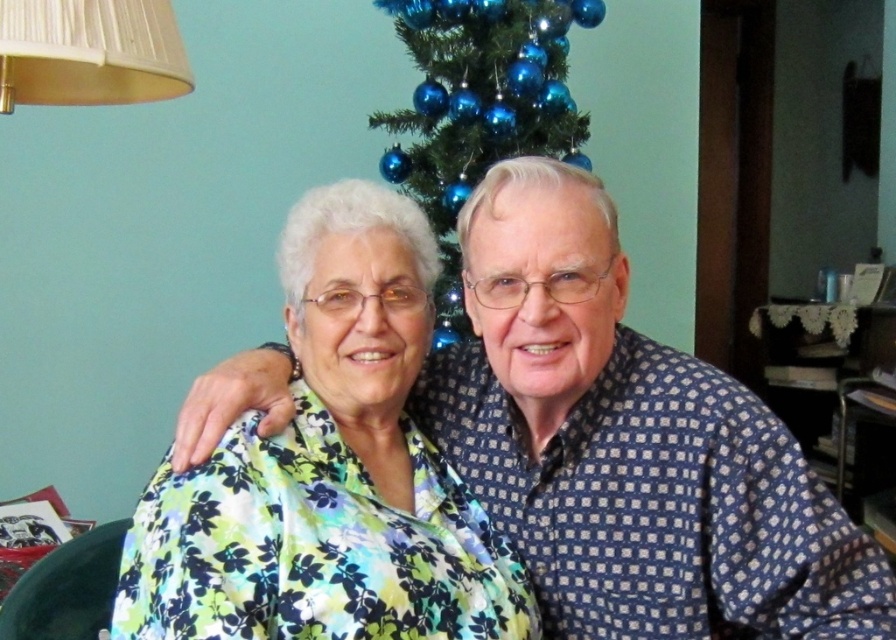
Question: Which is nearer to the floral fabric blouse at center?

Choices:
 (A) blue dotted shirt at center
 (B) blue glass ornaments at center

Answer: (A)

Question: In this image, where is blue dotted shirt at center located relative to blue glass ornaments at center?

Choices:
 (A) right
 (B) left

Answer: (A)

Question: Is floral fabric blouse at center below white pleated lampshade at upper left?

Choices:
 (A) no
 (B) yes

Answer: (B)

Question: From the image, what is the correct spatial relationship of blue dotted shirt at center in relation to floral fabric blouse at center?

Choices:
 (A) left
 (B) right

Answer: (B)

Question: Among these points, which one is farthest from the camera?

Choices:
 (A) (418, 131)
 (B) (632, 397)

Answer: (A)

Question: Which object appears farthest from the camera in this image?

Choices:
 (A) white pleated lampshade at upper left
 (B) blue glass ornaments at center
 (C) blue dotted shirt at center

Answer: (B)